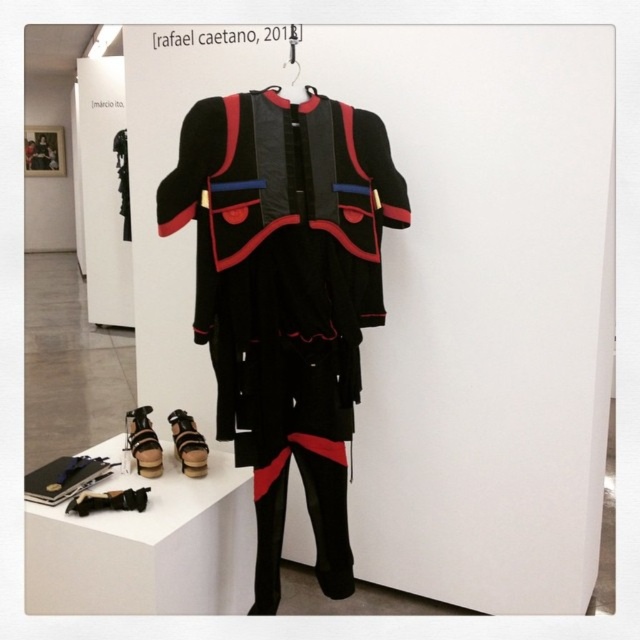
Is black smooth pants at lower center taller than matte black sandal at lower left?

Correct, black smooth pants at lower center is much taller as matte black sandal at lower left.

This screenshot has height=640, width=640. Describe the element at coordinates (308, 515) in the screenshot. I see `black smooth pants at lower center` at that location.

Does point (307, 477) lie behind point (147, 410)?

That is False.

Where is `black smooth pants at lower center`? The image size is (640, 640). black smooth pants at lower center is located at coordinates (308, 515).

The height and width of the screenshot is (640, 640). Describe the element at coordinates (285, 296) in the screenshot. I see `matte black uniform at center` at that location.

This screenshot has width=640, height=640. What do you see at coordinates (285, 296) in the screenshot?
I see `matte black uniform at center` at bounding box center [285, 296].

You are a GUI agent. You are given a task and a screenshot of the screen. Output one action in this format:
    pyautogui.click(x=<x>, y=<y>)
    Task: Click on the matte black uniform at center
    
    Given the screenshot: What is the action you would take?
    pyautogui.click(x=285, y=296)

Does black smooth pants at lower center have a larger size compared to leather sandal at lower center?

Correct, black smooth pants at lower center is larger in size than leather sandal at lower center.

Looking at this image, which is below, black smooth pants at lower center or leather sandal at lower center?

Positioned lower is black smooth pants at lower center.

Does point (340, 536) come in front of point (193, 468)?

Yes, point (340, 536) is closer to viewer.

Where is `black smooth pants at lower center`? black smooth pants at lower center is located at coordinates pos(308,515).